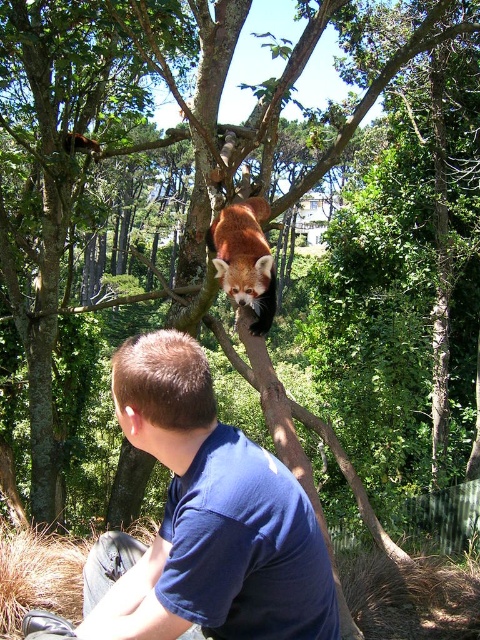
Question: Does blue cotton shirt at lower center have a lesser width compared to fluffy reddish-brown animal at upper center?

Choices:
 (A) no
 (B) yes

Answer: (A)

Question: Can you confirm if blue cotton shirt at lower center is thinner than fluffy reddish-brown animal at upper center?

Choices:
 (A) yes
 (B) no

Answer: (B)

Question: Among these points, which one is farthest from the camera?

Choices:
 (A) (245, 209)
 (B) (231, 454)

Answer: (A)

Question: Which point is closer to the camera taking this photo?

Choices:
 (A) (245, 205)
 (B) (130, 621)

Answer: (B)

Question: Where is blue cotton shirt at lower center located in relation to fluffy reddish-brown animal at upper center in the image?

Choices:
 (A) above
 (B) below

Answer: (B)